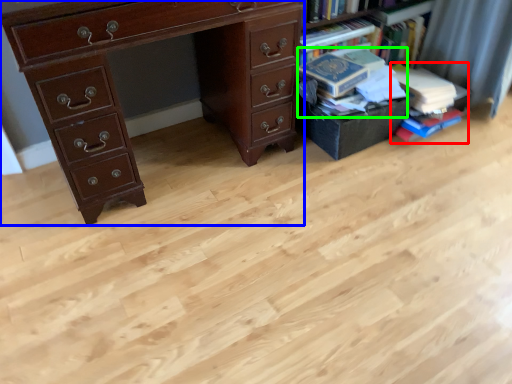
Question: Based on their relative distances, which object is nearer to book (highlighted by a red box)? Choose from chest of drawers (highlighted by a blue box) and book (highlighted by a green box).

Choices:
 (A) chest of drawers
 (B) book

Answer: (B)